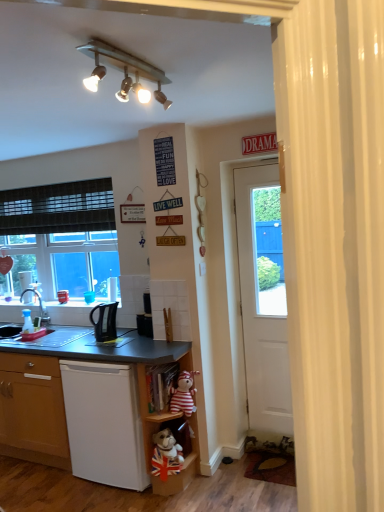
Where is `blank area beneath striped fabric teddy bear at lower center (from a real-world perspective)`? This screenshot has width=384, height=512. blank area beneath striped fabric teddy bear at lower center (from a real-world perspective) is located at coordinates (205, 483).